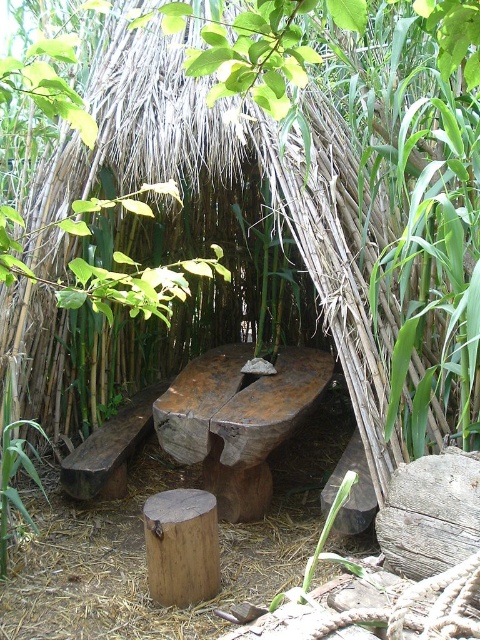
Question: Does green leafy plant at lower left have a larger size compared to green leafy plant at lower center?

Choices:
 (A) yes
 (B) no

Answer: (B)

Question: From the image, what is the correct spatial relationship of green leafy plant at lower left in relation to green leafy plant at lower center?

Choices:
 (A) right
 (B) left

Answer: (B)

Question: Which of the following is the closest to the observer?

Choices:
 (A) (29, 460)
 (B) (335, 508)

Answer: (B)

Question: Does green leafy plant at lower left have a lesser width compared to green leafy plant at lower center?

Choices:
 (A) no
 (B) yes

Answer: (B)